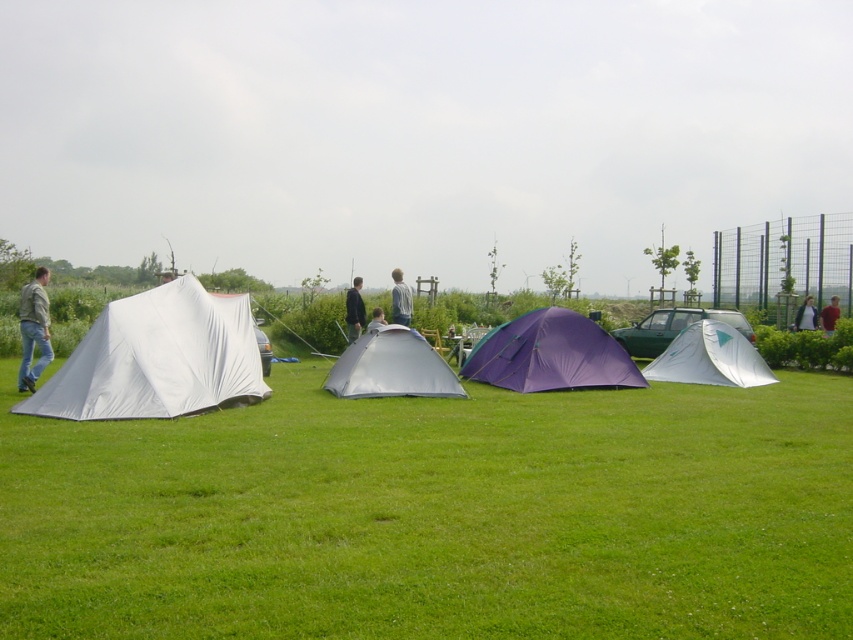
Question: Which point is farther to the camera?

Choices:
 (A) (809, 298)
 (B) (548, 358)

Answer: (A)

Question: Can you confirm if dark gray jacket at center is positioned to the right of light brown fabric tent at center?

Choices:
 (A) no
 (B) yes

Answer: (A)

Question: Which point is farther from the camera taking this photo?

Choices:
 (A) (30, 390)
 (B) (697, 360)
 (C) (549, 340)
 (D) (154, 378)

Answer: (B)

Question: Which point is closer to the camera?

Choices:
 (A) (831, 333)
 (B) (347, 308)
 (C) (556, 356)
 (D) (796, 314)

Answer: (C)

Question: Does dark gray jacket at center have a smaller size compared to red fabric shirt at center?

Choices:
 (A) no
 (B) yes

Answer: (A)

Question: Is the position of dark gray jacket at center more distant than that of gray fabric jacket at center?

Choices:
 (A) no
 (B) yes

Answer: (B)